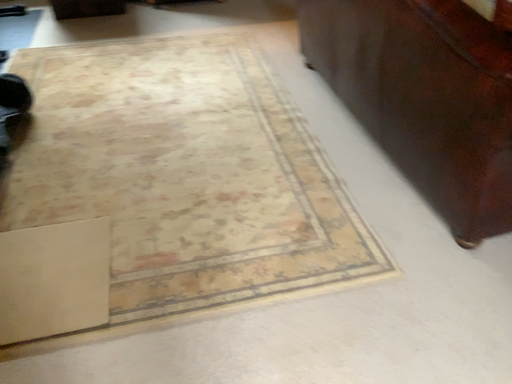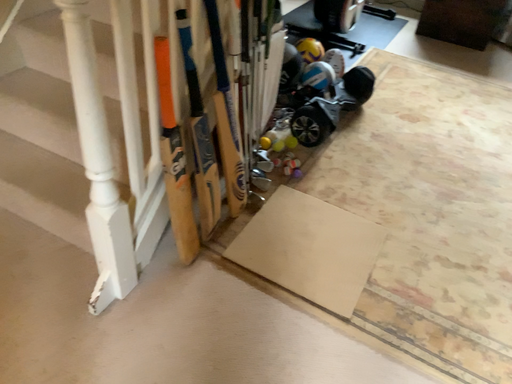
Question: Which way did the camera rotate in the video?

Choices:
 (A) rotated upward
 (B) rotated downward

Answer: (A)